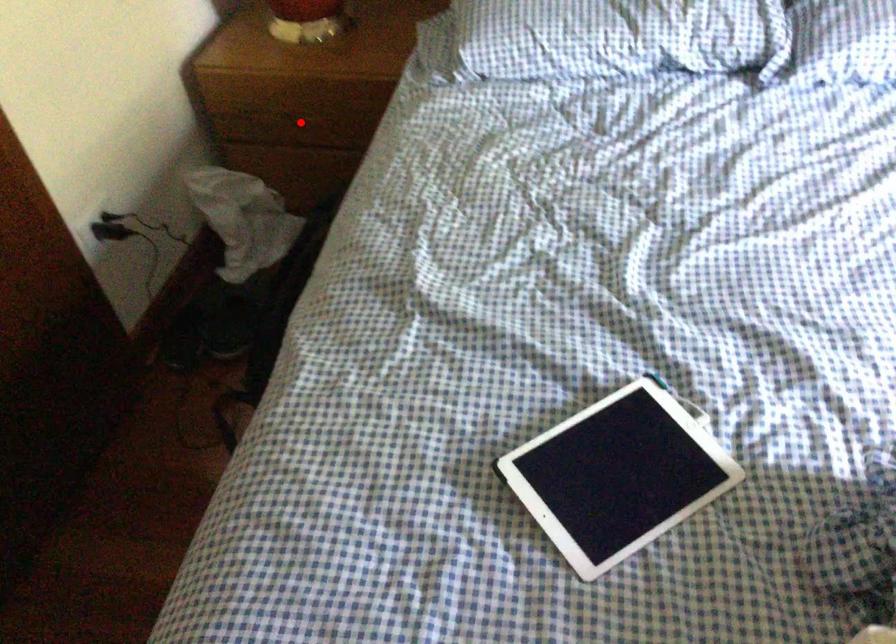
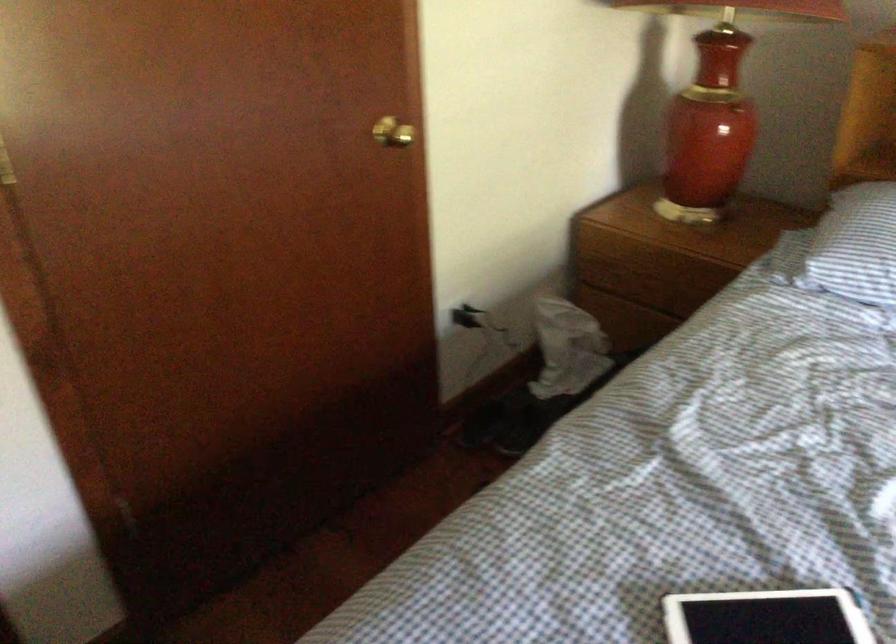
In the second image, find the point that corresponds to the highlighted location in the first image.

(650, 283)